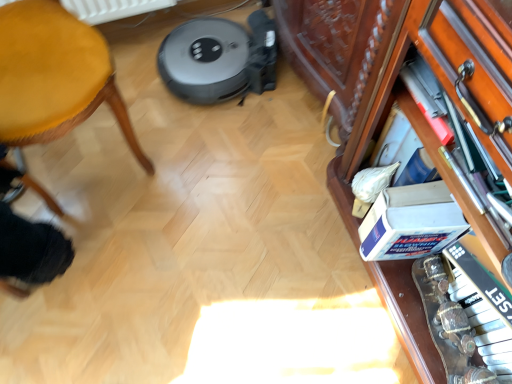
Question: Does yellow fabric stool at left turn towards wooden drawer at right?

Choices:
 (A) no
 (B) yes

Answer: (A)

Question: Considering the relative sizes of yellow fabric stool at left and wooden drawer at right in the image provided, is yellow fabric stool at left bigger than wooden drawer at right?

Choices:
 (A) yes
 (B) no

Answer: (A)

Question: Is yellow fabric stool at left placed right next to wooden drawer at right?

Choices:
 (A) yes
 (B) no

Answer: (B)

Question: Could wooden drawer at right be considered to be inside yellow fabric stool at left?

Choices:
 (A) no
 (B) yes

Answer: (A)

Question: From the image's perspective, would you say yellow fabric stool at left is positioned over wooden drawer at right?

Choices:
 (A) yes
 (B) no

Answer: (A)

Question: Would you say yellow fabric stool at left is to the left or to the right of white cardboard box at lower right in the picture?

Choices:
 (A) right
 (B) left

Answer: (B)

Question: Is yellow fabric stool at left inside the boundaries of white cardboard box at lower right, or outside?

Choices:
 (A) outside
 (B) inside

Answer: (A)

Question: In terms of height, does yellow fabric stool at left look taller or shorter compared to white cardboard box at lower right?

Choices:
 (A) short
 (B) tall

Answer: (B)

Question: In the image, is yellow fabric stool at left positioned in front of or behind white cardboard box at lower right?

Choices:
 (A) behind
 (B) front

Answer: (B)

Question: Would you say wooden piano keys at right is to the left or to the right of yellow fabric stool at left in the picture?

Choices:
 (A) left
 (B) right

Answer: (B)

Question: From a real-world perspective, is wooden piano keys at right positioned above or below yellow fabric stool at left?

Choices:
 (A) above
 (B) below

Answer: (B)

Question: Considering the positions of wooden piano keys at right and yellow fabric stool at left in the image, is wooden piano keys at right bigger or smaller than yellow fabric stool at left?

Choices:
 (A) small
 (B) big

Answer: (A)

Question: Relative to yellow fabric stool at left, is wooden piano keys at right in front or behind?

Choices:
 (A) behind
 (B) front

Answer: (A)

Question: Considering the relative positions of wooden drawer at right and white cardboard box at lower right in the image provided, is wooden drawer at right to the left or to the right of white cardboard box at lower right?

Choices:
 (A) left
 (B) right

Answer: (B)

Question: Looking at the image, does wooden drawer at right seem bigger or smaller compared to white cardboard box at lower right?

Choices:
 (A) big
 (B) small

Answer: (A)